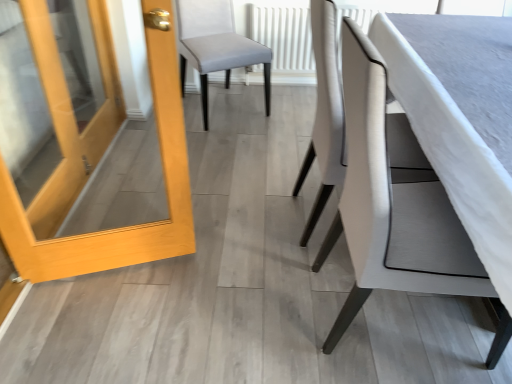
In order to face light gray fabric chair at center, the 3th chair from the front, should I rotate leftwards or rightwards?

Rotate left and turn 4.633 degrees.

At what (x,y) coordinates should I click in order to perform the action: click on white fabric chair at center, which is counted as the 2th chair, starting from the back. Please return your answer as a coordinate pair (x, y). The image size is (512, 384). Looking at the image, I should click on (325, 110).

Do you think white textured radiator at center is within light wood/matte door at left, or outside of it?

white textured radiator at center is spatially situated outside light wood/matte door at left.

Looking at this image, between white textured radiator at center and light wood/matte door at left, which one appears on the right side from the viewer's perspective?

Positioned to the right is white textured radiator at center.

Is white textured radiator at center taller than light wood/matte door at left?

No, white textured radiator at center is not taller than light wood/matte door at left.

From the white textured radiator at center, count 2nd chairs forward and point to it. Please provide its 2D coordinates.

[(325, 110)]

Is white fabric chair at center, which is counted as the 2th chair, starting from the back, far from white textured radiator at center?

Yes, white fabric chair at center, which is counted as the 2th chair, starting from the back, and white textured radiator at center are quite far apart.

What's the angular difference between white fabric chair at center, which is counted as the 2th chair, starting from the back, and white textured radiator at center's facing directions?

They differ by 91 degrees in their facing directions.

Choose the correct answer: Is white fabric chair at center, the second chair from the front, inside white textured radiator at center or outside it?

white fabric chair at center, the second chair from the front, exists outside the volume of white textured radiator at center.

Is light wood/matte door at left positioned beyond the bounds of white textured radiator at center?

Yes, light wood/matte door at left is located beyond the bounds of white textured radiator at center.

Which is behind, light wood/matte door at left or white textured radiator at center?

white textured radiator at center is further away from the camera.

Based on the photo, from a real-world perspective, which is physically above, light wood/matte door at left or white textured radiator at center?

light wood/matte door at left.

Find the location of a particular element. The width and height of the screenshot is (512, 384). radiator above the light wood/matte door at left (from the image's perspective) is located at coordinates (284, 37).

Is white fabric chair at center, the second chair from the front, next to light gray fabric chair at center, the 3th chair from the front, and touching it?

No.

Find the location of a particular element. This screenshot has height=384, width=512. chair behind the white fabric chair at center, the second chair from the front is located at coordinates (216, 46).

From the image's perspective, is white fabric chair at center, the second chair from the front, over light gray fabric chair at center, which ranks as the first chair in back-to-front order?

No, from the image's perspective, white fabric chair at center, the second chair from the front, is not on top of light gray fabric chair at center, which ranks as the first chair in back-to-front order.

Is white fabric chair at center, which is counted as the 2th chair, starting from the back, not inside light gray fabric chair at center, which ranks as the first chair in back-to-front order?

white fabric chair at center, which is counted as the 2th chair, starting from the back, lies outside light gray fabric chair at center, which ranks as the first chair in back-to-front order,'s area.

Do you think white fabric chair at center, which is the first chair in front-to-back order, is within white fabric chair at center, the second chair from the front, or outside of it?

white fabric chair at center, which is the first chair in front-to-back order, lies outside white fabric chair at center, the second chair from the front.

The height and width of the screenshot is (384, 512). I want to click on chair lying in front of the white fabric chair at center, the second chair from the front, so (x=397, y=204).

Is white fabric chair at center, which is the first chair in front-to-back order, aimed at white fabric chair at center, which is counted as the 2th chair, starting from the back?

No, white fabric chair at center, which is the first chair in front-to-back order, does not turn towards white fabric chair at center, which is counted as the 2th chair, starting from the back.

Are white fabric chair at center, which is the first chair in front-to-back order, and white fabric chair at center, which is counted as the 2th chair, starting from the back, making contact?

white fabric chair at center, which is the first chair in front-to-back order, and white fabric chair at center, which is counted as the 2th chair, starting from the back, are not in contact.

From the image's perspective, would you say light gray fabric chair at center, which ranks as the first chair in back-to-front order, is positioned over white fabric chair at center, which is the first chair in front-to-back order?

Correct, light gray fabric chair at center, which ranks as the first chair in back-to-front order, appears higher than white fabric chair at center, which is the first chair in front-to-back order, in the image.

Is light gray fabric chair at center, which ranks as the first chair in back-to-front order, wider or thinner than white fabric chair at center, which is the first chair in front-to-back order?

Considering their sizes, light gray fabric chair at center, which ranks as the first chair in back-to-front order, looks broader than white fabric chair at center, which is the first chair in front-to-back order.

From a real-world perspective, between light gray fabric chair at center, which ranks as the first chair in back-to-front order, and white fabric chair at center, which is the first chair in front-to-back order, who is vertically lower?

From a 3D spatial view, light gray fabric chair at center, which ranks as the first chair in back-to-front order, is below.

Does point (181, 67) come closer to viewer compared to point (492, 360)?

No, it is not.

Is white textured radiator at center at the right side of white fabric chair at center, the second chair from the front?

Yes, white textured radiator at center is to the right of white fabric chair at center, the second chair from the front.

Between white textured radiator at center and white fabric chair at center, the second chair from the front, which one has less height?

white textured radiator at center.

From a real-world perspective, which object rests below the other?

white textured radiator at center.

Find the location of a particular element. Image resolution: width=512 pixels, height=384 pixels. door on the left of white textured radiator at center is located at coordinates (96, 163).

Locate an element on the screen. The width and height of the screenshot is (512, 384). chair that is the 2nd object located below the white textured radiator at center (from the image's perspective) is located at coordinates (325, 110).

Based on their spatial positions, is white fabric chair at center, which is counted as the 2th chair, starting from the back, or white fabric chair at center, which is the first chair in front-to-back order, further from light wood/matte door at left?

white fabric chair at center, which is the first chair in front-to-back order, is positioned further to the anchor light wood/matte door at left.

Which object lies further to the anchor point white fabric chair at center, positioned as the 3th chair in back-to-front order, white textured radiator at center or white fabric chair at center, which is counted as the 2th chair, starting from the back?

white textured radiator at center is positioned further to the anchor white fabric chair at center, positioned as the 3th chair in back-to-front order.

Considering their positions, is white fabric chair at center, which is counted as the 2th chair, starting from the back, positioned further to white textured radiator at center than white fabric chair at center, which is the first chair in front-to-back order?

Based on the image, white fabric chair at center, which is the first chair in front-to-back order, appears to be further to white textured radiator at center.

Which object lies further to the anchor point white fabric chair at center, positioned as the 3th chair in back-to-front order, light gray fabric chair at center, the 3th chair from the front, or light wood/matte door at left?

light gray fabric chair at center, the 3th chair from the front.

Which object lies nearer to the anchor point light wood/matte door at left, light gray fabric chair at center, the 3th chair from the front, or white fabric chair at center, which is the first chair in front-to-back order?

Among the two, light gray fabric chair at center, the 3th chair from the front, is located nearer to light wood/matte door at left.

Looking at the image, which one is located closer to white fabric chair at center, which is the first chair in front-to-back order, white fabric chair at center, which is counted as the 2th chair, starting from the back, or light gray fabric chair at center, the 3th chair from the front?

The object closer to white fabric chair at center, which is the first chair in front-to-back order, is white fabric chair at center, which is counted as the 2th chair, starting from the back.

From the picture: Which object lies nearer to the anchor point white textured radiator at center, light gray fabric chair at center, the 3th chair from the front, or white fabric chair at center, which is the first chair in front-to-back order?

light gray fabric chair at center, the 3th chair from the front, is positioned closer to the anchor white textured radiator at center.

Which object lies further to the anchor point white fabric chair at center, positioned as the 3th chair in back-to-front order, white textured radiator at center or light wood/matte door at left?

Based on the image, white textured radiator at center appears to be further to white fabric chair at center, positioned as the 3th chair in back-to-front order.

This screenshot has width=512, height=384. I want to click on chair between light wood/matte door at left and light gray fabric chair at center, the 3th chair from the front, in the front-back direction, so click(325, 110).

Locate an element on the screen. The width and height of the screenshot is (512, 384). chair between white fabric chair at center, positioned as the 3th chair in back-to-front order, and light gray fabric chair at center, the 3th chair from the front, from front to back is located at coordinates (325, 110).

Find the location of a particular element. door located between white fabric chair at center, positioned as the 3th chair in back-to-front order, and light gray fabric chair at center, the 3th chair from the front, in the depth direction is located at coordinates (96, 163).

I want to click on chair between white fabric chair at center, which is counted as the 2th chair, starting from the back, and white textured radiator at center, along the z-axis, so click(x=216, y=46).